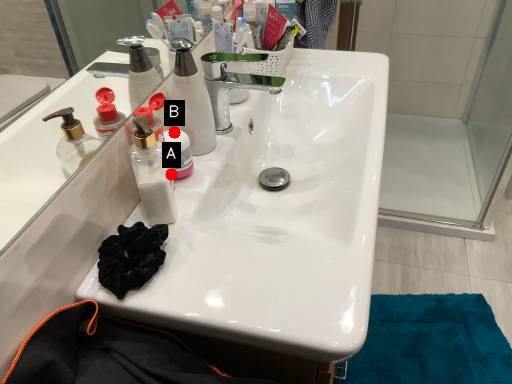
Question: Two points are circled on the image, labeled by A and B beside each circle. Among these points, which one is nearest to the camera?

Choices:
 (A) A is closer
 (B) B is closer

Answer: (B)